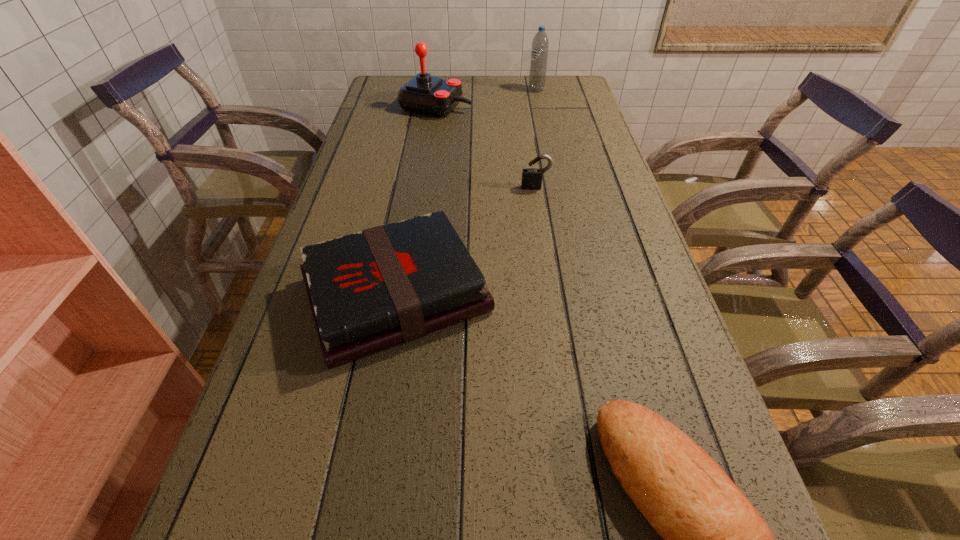
Locate an element on the screen. The image size is (960, 540). joystick at the left edge is located at coordinates (425, 94).

Locate an element on the screen. The image size is (960, 540). hardback book that is at the left edge is located at coordinates (372, 290).

Where is `object that is at the right edge`? This screenshot has width=960, height=540. object that is at the right edge is located at coordinates (539, 53).

Locate an element on the screen. The width and height of the screenshot is (960, 540). object that is at the far left corner is located at coordinates (425, 94).

This screenshot has width=960, height=540. What are the coordinates of `object located in the far right corner section of the desktop` in the screenshot? It's located at (539, 53).

In the image, there is a desktop. Identify the location of free space at the far edge. This screenshot has height=540, width=960. (506, 90).

Locate an element on the screen. The height and width of the screenshot is (540, 960). vacant space at the left edge of the desktop is located at coordinates (359, 186).

What are the coordinates of `free space at the right edge of the desktop` in the screenshot? It's located at (565, 192).

In the image, there is a desktop. Where is `vacant space at the far left corner`? vacant space at the far left corner is located at coordinates (378, 91).

Locate an element on the screen. The image size is (960, 540). free space between the hardback book and the padlock is located at coordinates (466, 241).